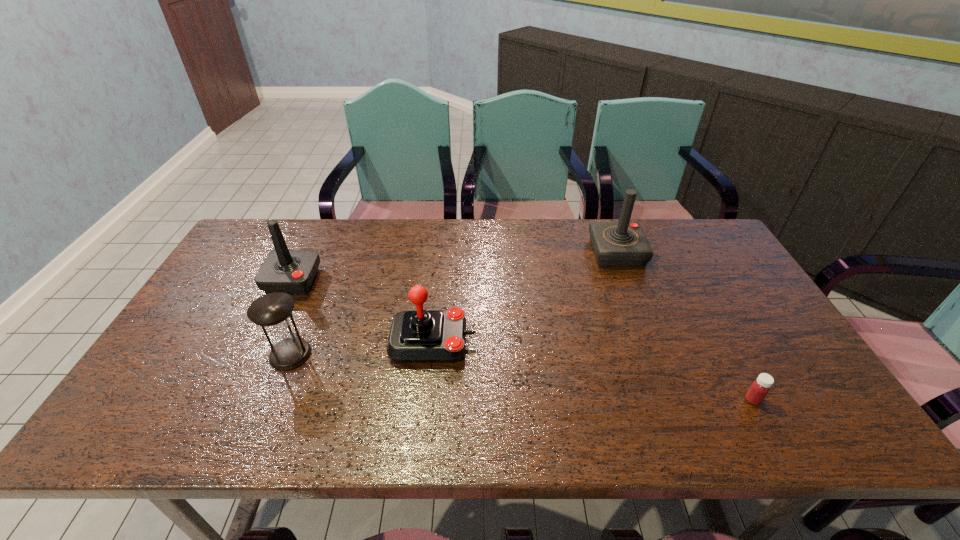
In the image, there is a desktop. Identify the location of free space at the near edge. (374, 408).

Locate an element on the screen. This screenshot has width=960, height=540. free space at the left edge of the desktop is located at coordinates (213, 300).

Image resolution: width=960 pixels, height=540 pixels. In order to click on free location at the right edge of the desktop in this screenshot , I will do `click(705, 298)`.

The width and height of the screenshot is (960, 540). I want to click on vacant space at the far left corner of the desktop, so click(x=266, y=220).

This screenshot has height=540, width=960. In the image, there is a desktop. In order to click on vacant space at the far right corner in this screenshot , I will do `click(708, 258)`.

Find the location of a particular element. This screenshot has width=960, height=540. unoccupied position between the leftmost joystick and the rightmost joystick is located at coordinates (455, 266).

Identify the location of free space between the hourglass and the second joystick from left to right. This screenshot has height=540, width=960. (362, 348).

Where is `free point between the leftmost joystick and the nearest object`? free point between the leftmost joystick and the nearest object is located at coordinates (522, 340).

What are the coordinates of `empty location between the second object from right to left and the hourglass` in the screenshot? It's located at (454, 303).

This screenshot has width=960, height=540. I want to click on vacant area that lies between the hourglass and the medicine, so click(521, 377).